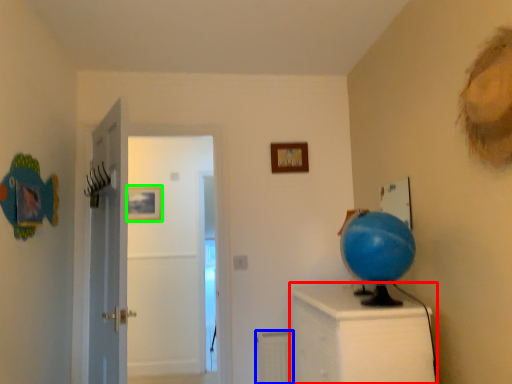
Question: Considering the real-world distances, which object is farthest from furniture (highlighted by a red box)? radiator (highlighted by a blue box) or picture frame (highlighted by a green box)?

Choices:
 (A) radiator
 (B) picture frame

Answer: (B)